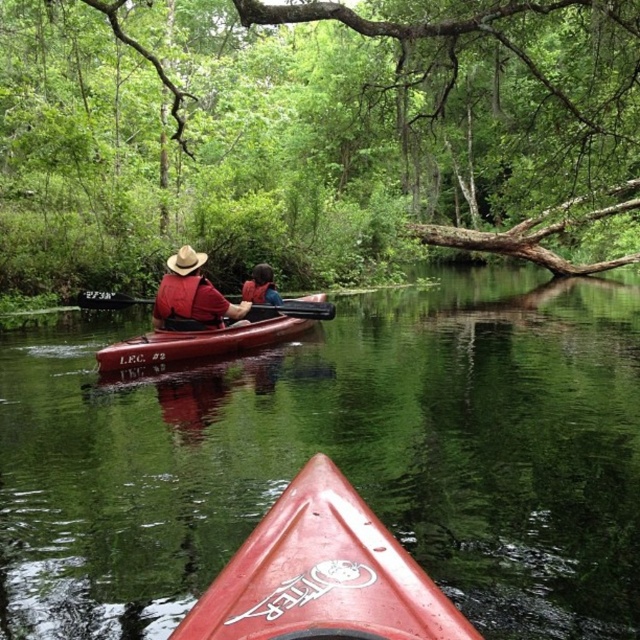
Does point (157, 156) lie in front of point (211, 332)?

No, (157, 156) is further to viewer.

Is smooth brown log at center in front of matte red canoe at center?

That is False.

Identify the location of smooth brown log at center. This screenshot has width=640, height=640. (312, 134).

Does smooth brown log at center appear on the left side of smooth black paddle at center?

Incorrect, smooth brown log at center is not on the left side of smooth black paddle at center.

How much distance is there between smooth brown log at center and smooth black paddle at center?

smooth brown log at center and smooth black paddle at center are 14.56 meters apart.

Which is behind, point (296, 45) or point (84, 291)?

The point (296, 45) is behind.

The height and width of the screenshot is (640, 640). What are the coordinates of `smooth brown log at center` in the screenshot? It's located at (312, 134).

Can you confirm if red plastic kayak at center is taller than matte red shirt at center?

Yes.

Between red plastic kayak at center and matte red shirt at center, which one is positioned higher?

Positioned higher is matte red shirt at center.

The width and height of the screenshot is (640, 640). In order to click on red plastic kayak at center in this screenshot , I will do `click(339, 458)`.